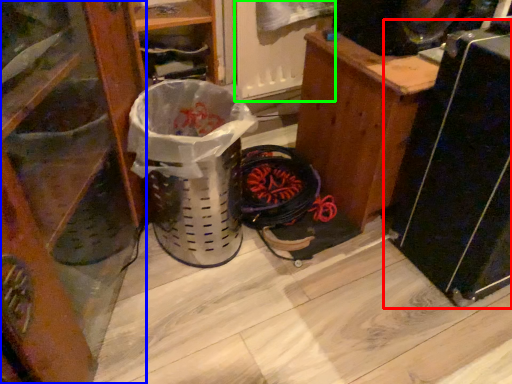
Question: Which object is positioned closest to appliance (highlighted by a red box)? Select from furniture (highlighted by a blue box) and screen door (highlighted by a green box).

Choices:
 (A) furniture
 (B) screen door

Answer: (B)